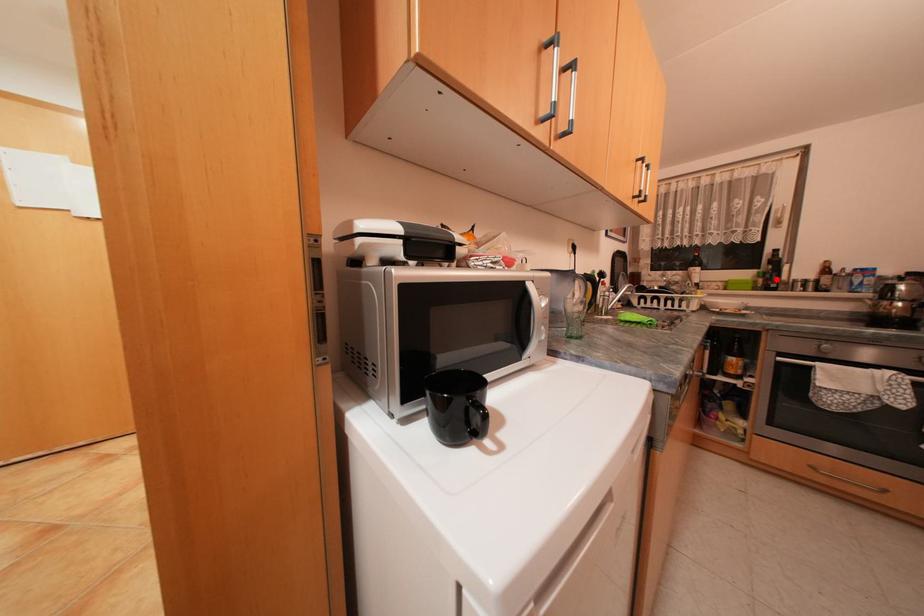
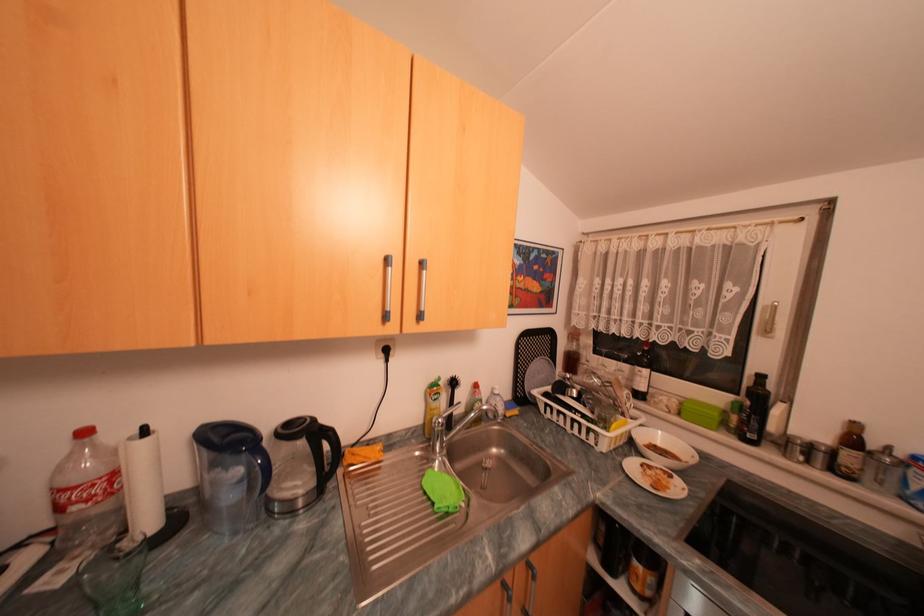
Question: I am providing you with two images of the same scene from different viewpoints. A red point is marked on the first image. Is the red point's position out of view in image 2?

Choices:
 (A) Yes
 (B) No

Answer: (B)